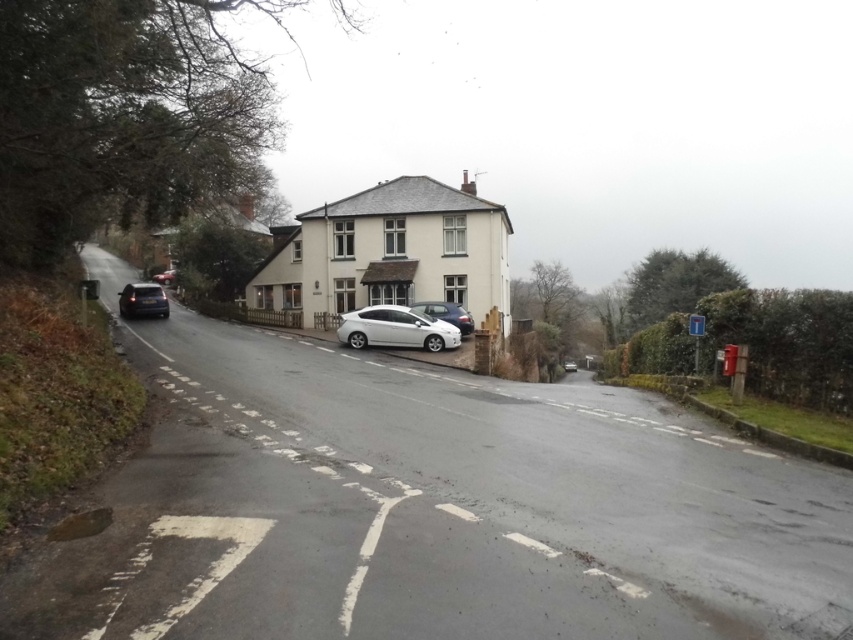
This screenshot has height=640, width=853. What do you see at coordinates (395, 328) in the screenshot?
I see `satin white sedan at center` at bounding box center [395, 328].

Does point (410, 344) lie in front of point (123, 316)?

Yes, it is.

Is point (439, 336) closer to viewer compared to point (149, 291)?

Yes, point (439, 336) is closer to viewer.

The image size is (853, 640). I want to click on satin white sedan at center, so click(x=395, y=328).

Is satin white sedan at center below satin silver sedan at center?

Indeed, satin white sedan at center is positioned under satin silver sedan at center.

Does point (346, 323) come closer to viewer compared to point (450, 314)?

That is True.

The height and width of the screenshot is (640, 853). I want to click on satin white sedan at center, so click(x=395, y=328).

Which is in front, point (146, 307) or point (469, 323)?

Point (469, 323) is more forward.

Does shiny dark blue sedan at left have a larger size compared to satin silver sedan at center?

Yes, shiny dark blue sedan at left is bigger than satin silver sedan at center.

Who is more distant from viewer, (144, 298) or (462, 314)?

Positioned behind is point (144, 298).

Locate an element on the screen. Image resolution: width=853 pixels, height=640 pixels. shiny dark blue sedan at left is located at coordinates (142, 300).